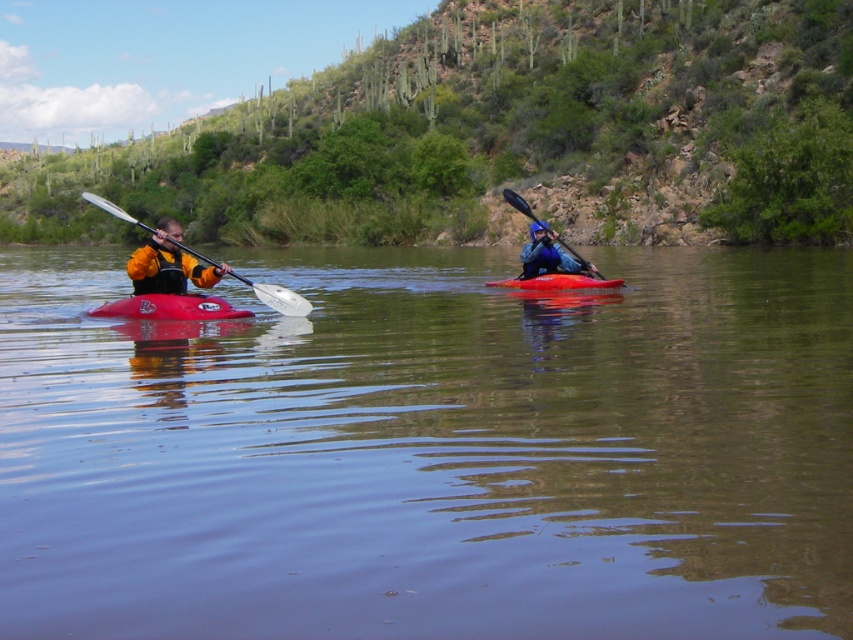
Question: Is matte red kayak at left above blue matte kayak at center?

Choices:
 (A) no
 (B) yes

Answer: (A)

Question: Which point is farther to the camera?

Choices:
 (A) orange waterproof jacket at left
 (B) white plastic paddle at left

Answer: (B)

Question: Observing the image, what is the correct spatial positioning of orange waterproof jacket at left in reference to matte red kayak at center?

Choices:
 (A) above
 (B) below

Answer: (A)

Question: Which object is closer to the camera taking this photo?

Choices:
 (A) blue matte kayak at center
 (B) matte red kayak at center
 (C) orange waterproof jacket at left

Answer: (C)

Question: Can you confirm if matte red kayak at left is positioned below blue matte kayak at center?

Choices:
 (A) no
 (B) yes

Answer: (B)

Question: Considering the real-world distances, which object is closest to the orange waterproof jacket at left?

Choices:
 (A) blue matte kayak at center
 (B) green leafy hillside at upper center
 (C) matte red kayak at left

Answer: (C)